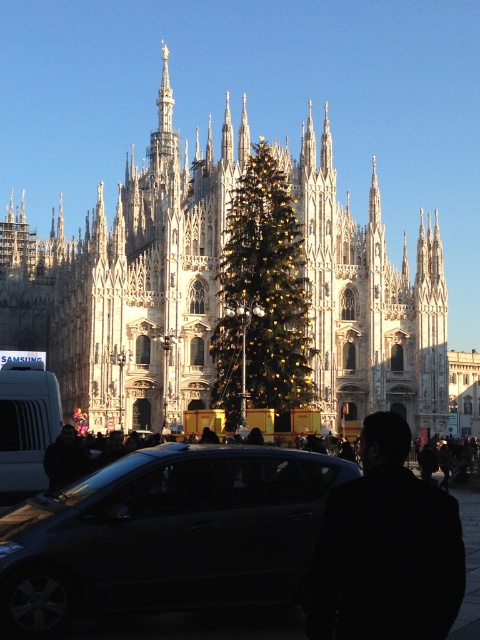
Question: Which point is farther from the camera taking this photo?

Choices:
 (A) (384, 602)
 (B) (219, 468)

Answer: (B)

Question: Which of the following is the farthest from the observer?

Choices:
 (A) (193, 308)
 (B) (60, 420)

Answer: (A)

Question: Which point is closer to the camera?

Choices:
 (A) black wool coat at center
 (B) shiny black car at center

Answer: (A)

Question: Is shiny black car at center below gold/golden/ornate christmas tree at center?

Choices:
 (A) yes
 (B) no

Answer: (A)

Question: Can you confirm if shiny black car at center is positioned above matte silver van at left?

Choices:
 (A) yes
 (B) no

Answer: (B)

Question: Is white stone church at center to the left of shiny black car at center from the viewer's perspective?

Choices:
 (A) yes
 (B) no

Answer: (B)